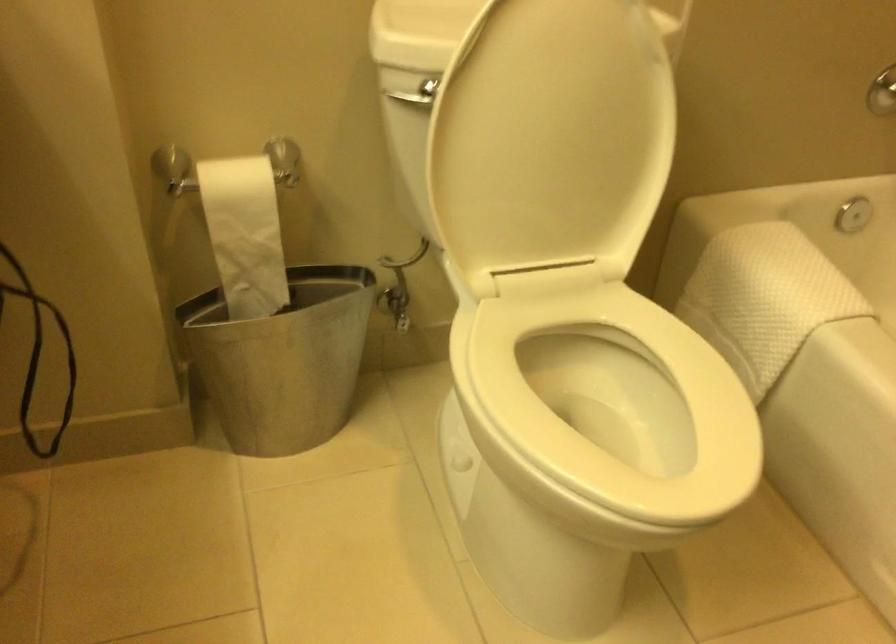
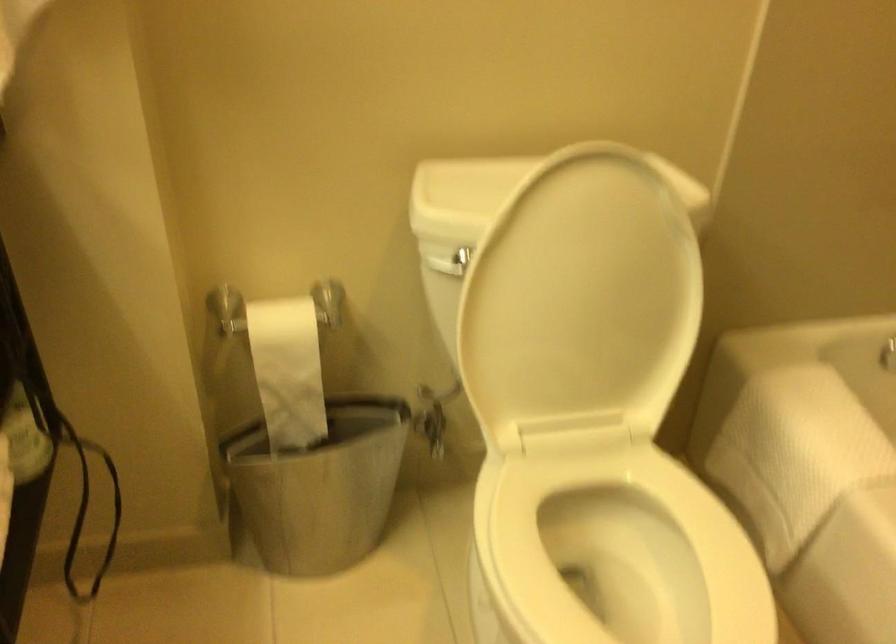
What movement of the cameraman would produce the second image?

The cameraman walked toward right, backward.